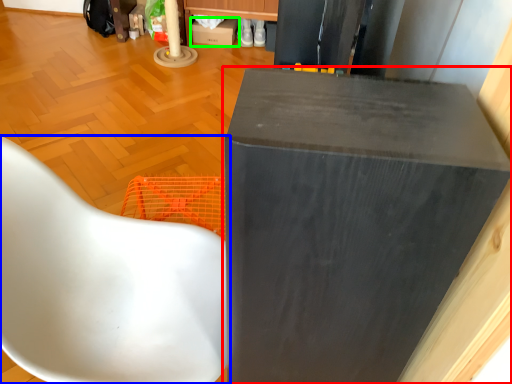
Question: Estimate the real-world distances between objects in this image. Which object is farther from furniture (highlighted by a red box), chair (highlighted by a blue box) or cardboard box (highlighted by a green box)?

Choices:
 (A) chair
 (B) cardboard box

Answer: (B)